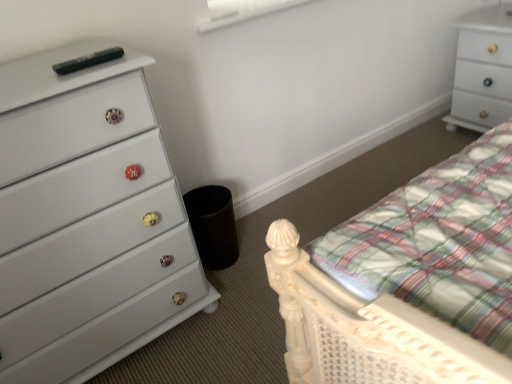
Question: From the image's perspective, is white glossy chest of drawers at upper right, arranged as the 1th chest of drawers when viewed from the top, under white glossy chest of drawers at left, acting as the first chest of drawers starting from the front?

Choices:
 (A) yes
 (B) no

Answer: (B)

Question: Considering the relative positions of white glossy chest of drawers at upper right, positioned as the second chest of drawers in front-to-back order, and white glossy chest of drawers at left, which is the second chest of drawers in back-to-front order, in the image provided, is white glossy chest of drawers at upper right, positioned as the second chest of drawers in front-to-back order, to the right of white glossy chest of drawers at left, which is the second chest of drawers in back-to-front order, from the viewer's perspective?

Choices:
 (A) no
 (B) yes

Answer: (B)

Question: Is white glossy chest of drawers at upper right, arranged as the 1th chest of drawers when viewed from the top, shorter than white glossy chest of drawers at left, the first chest of drawers positioned from the left?

Choices:
 (A) yes
 (B) no

Answer: (A)

Question: Would you say white glossy chest of drawers at upper right, positioned as the second chest of drawers in front-to-back order, is outside white glossy chest of drawers at left, marked as the second chest of drawers in a top-to-bottom arrangement?

Choices:
 (A) yes
 (B) no

Answer: (A)

Question: Could you tell me if white glossy chest of drawers at upper right, which ranks as the second chest of drawers in bottom-to-top order, is facing white glossy chest of drawers at left, which is the 1th chest of drawers from bottom to top?

Choices:
 (A) yes
 (B) no

Answer: (A)

Question: Relative to white matte window screen at upper center, is white glossy chest of drawers at upper right, which ranks as the 1th chest of drawers in right-to-left order, in front or behind?

Choices:
 (A) behind
 (B) front

Answer: (A)

Question: Is white glossy chest of drawers at upper right, which ranks as the 1th chest of drawers in right-to-left order, spatially inside white matte window screen at upper center, or outside of it?

Choices:
 (A) outside
 (B) inside

Answer: (A)

Question: Considering the positions of white glossy chest of drawers at upper right, which is counted as the 1th chest of drawers, starting from the back, and white matte window screen at upper center in the image, is white glossy chest of drawers at upper right, which is counted as the 1th chest of drawers, starting from the back, bigger or smaller than white matte window screen at upper center?

Choices:
 (A) small
 (B) big

Answer: (B)

Question: From the image's perspective, is white glossy chest of drawers at upper right, arranged as the 1th chest of drawers when viewed from the top, above or below white matte window screen at upper center?

Choices:
 (A) below
 (B) above

Answer: (A)

Question: Considering the positions of point [123, 203] and point [479, 129], is point [123, 203] closer or farther from the camera than point [479, 129]?

Choices:
 (A) closer
 (B) farther

Answer: (A)

Question: Relative to white glossy chest of drawers at upper right, the 2th chest of drawers from the left, is white glossy chest of drawers at left, acting as the first chest of drawers starting from the front, in front or behind?

Choices:
 (A) behind
 (B) front

Answer: (B)

Question: Do you think white glossy chest of drawers at left, acting as the second chest of drawers starting from the right, is within white glossy chest of drawers at upper right, positioned as the second chest of drawers in front-to-back order, or outside of it?

Choices:
 (A) outside
 (B) inside

Answer: (A)

Question: From a real-world perspective, is white glossy chest of drawers at left, which is the 1th chest of drawers from bottom to top, physically located above or below white glossy chest of drawers at upper right, arranged as the 1th chest of drawers when viewed from the top?

Choices:
 (A) below
 (B) above

Answer: (B)

Question: Relative to white glossy chest of drawers at upper right, positioned as the second chest of drawers in front-to-back order, is white matte window screen at upper center in front or behind?

Choices:
 (A) behind
 (B) front

Answer: (B)

Question: Based on their sizes in the image, would you say white matte window screen at upper center is bigger or smaller than white glossy chest of drawers at upper right, which ranks as the 1th chest of drawers in right-to-left order?

Choices:
 (A) big
 (B) small

Answer: (B)